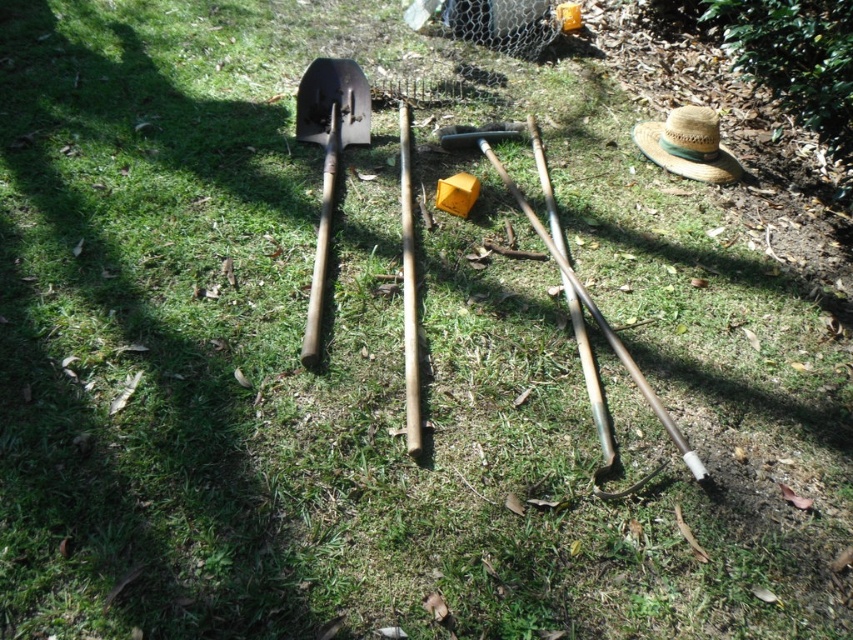
You are standing in a garden and see the straw hat at lower right and the wooden baseball bat at center. Which object is taller?

The wooden baseball bat at center is taller than the straw hat at lower right.

You are organizing a garden cleanup and need to place the straw hat at lower right and wooden baseball bat at center into storage. Which object should you pick up first if you want to start with the one closer to the fence in the background?

The wooden baseball bat at center should be picked up first because the straw hat at lower right is positioned on the right side of it, meaning the bat is closer to the fence in the background.

You are trying to decide which tool to pick up first. Based on their widths, which one is wider, the wooden shovel at center or the wooden baseball bat at center?

The wooden shovel at center is wider than the wooden baseball bat at center according to the description.